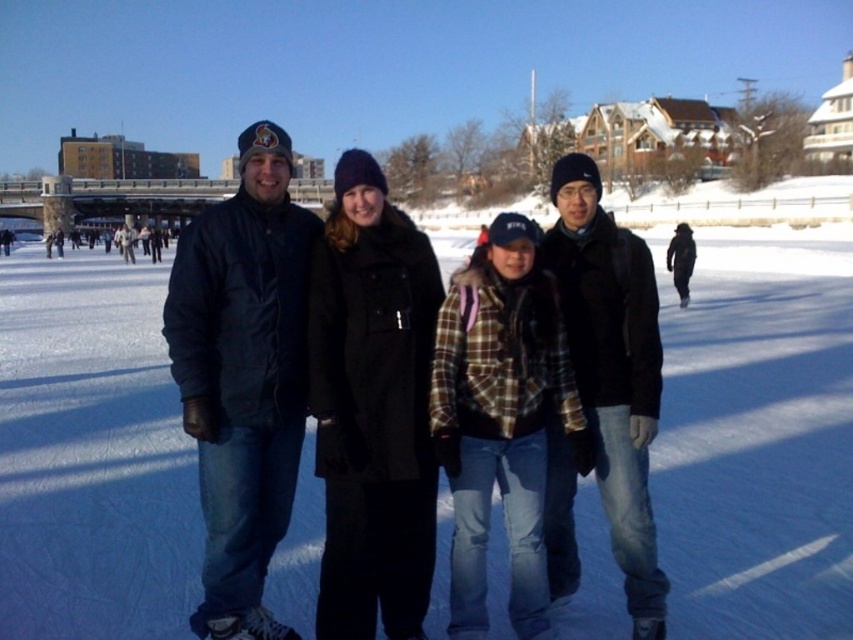
You are standing on the ice skating rink and see two people wearing dark blue jackets. Which one is closer to you, the dark blue jacket at left or the dark blue jacket at center?

The dark blue jacket at left is closer to the viewer than the dark blue jacket at center.